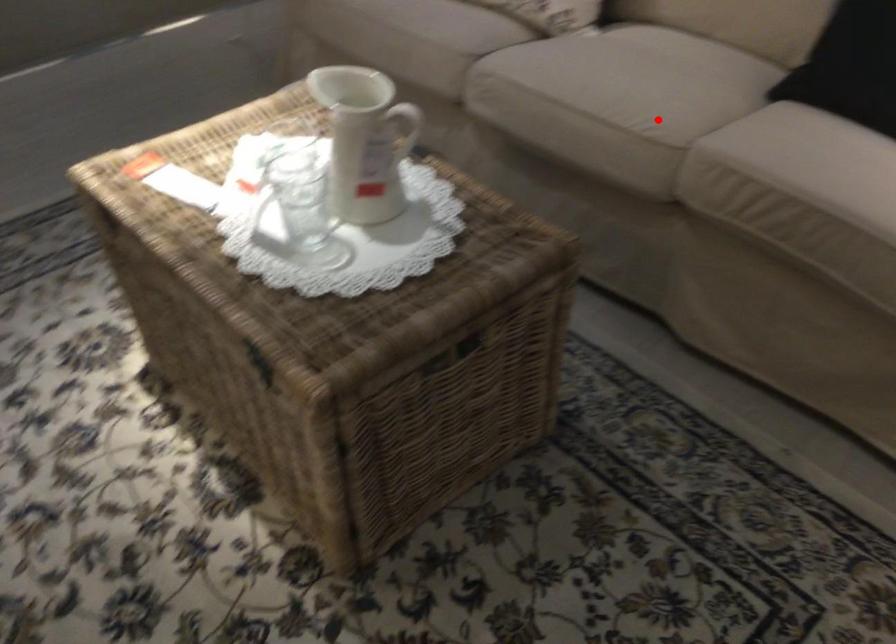
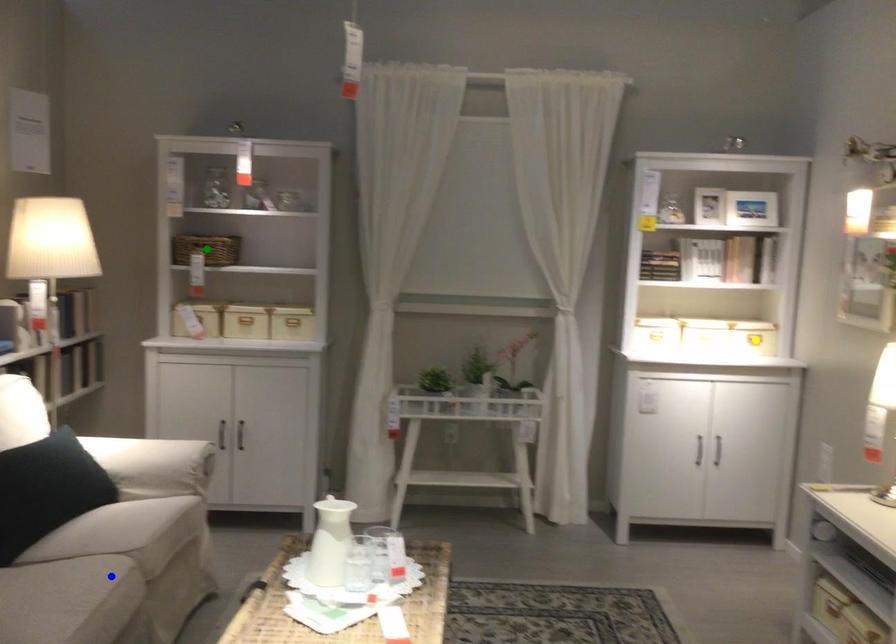
Question: I am providing you with two images of the same scene from different viewpoints. A red point is marked on the first image. You are given multiple points on the second image. In image 2, which mark is for the same physical point as the one in image 1?

Choices:
 (A) yellow point
 (B) green point
 (C) blue point

Answer: (C)